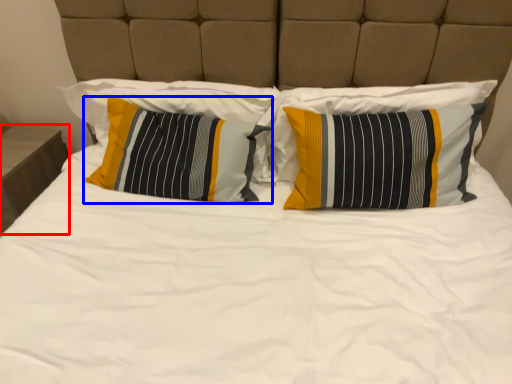
Question: Which of the following is the closest to the observer, nightstand (highlighted by a red box) or pillow (highlighted by a blue box)?

Choices:
 (A) nightstand
 (B) pillow

Answer: (B)